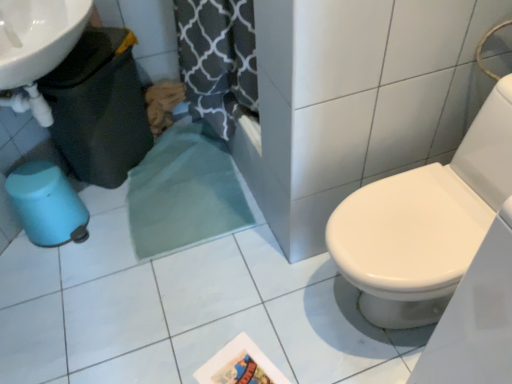
You are a GUI agent. You are given a task and a screenshot of the screen. Output one action in this format:
    pyautogui.click(x=<x>, y=<y>)
    Task: Click on the vacant area located to the right-hand side of matte black trash can at left, marked as the 1th potty in a top-to-bottom arrangement
    The height and width of the screenshot is (384, 512).
    Given the screenshot: What is the action you would take?
    pyautogui.click(x=182, y=172)